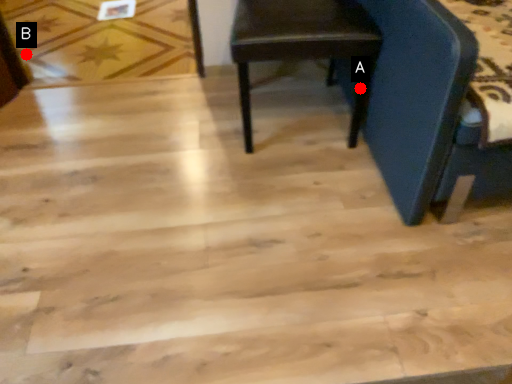
Question: Two points are circled on the image, labeled by A and B beside each circle. Which point is further to the camera?

Choices:
 (A) A is further
 (B) B is further

Answer: (B)